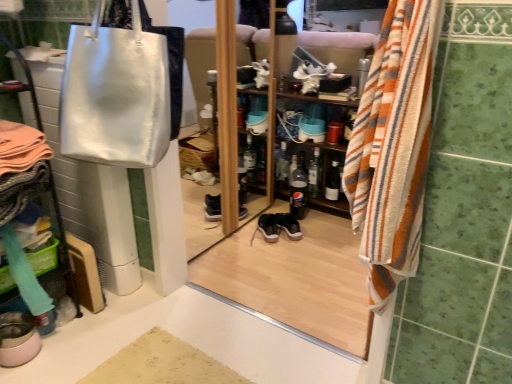
The width and height of the screenshot is (512, 384). I want to click on free area behind beige textured bath mat at lower center, so click(x=175, y=319).